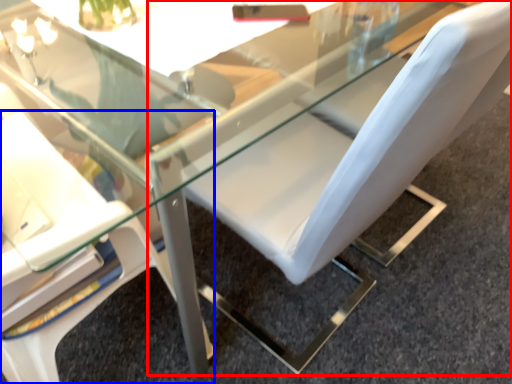
Question: Among these objects, which one is nearest to the camera, chair (highlighted by a red box) or chair (highlighted by a blue box)?

Choices:
 (A) chair
 (B) chair

Answer: (B)